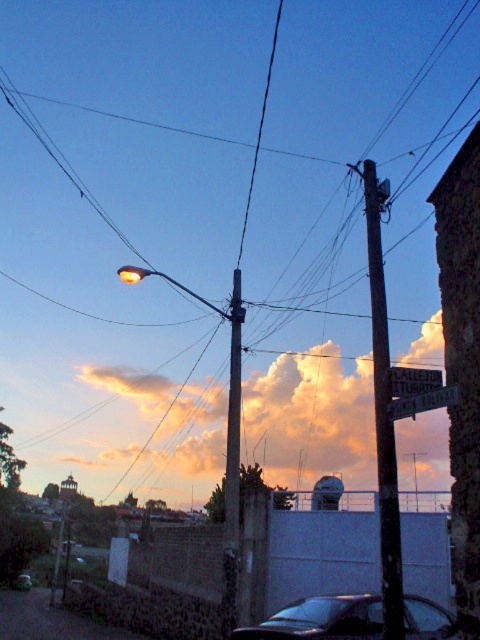
Question: Which point is closer to the camera?

Choices:
 (A) matte metal street light at upper left
 (B) black wire at upper center
 (C) shiny black car at lower center
 (D) metallic silver street sign at upper right

Answer: (D)

Question: Is shiny black car at lower center below metallic silver sign at upper center?

Choices:
 (A) no
 (B) yes

Answer: (B)

Question: Which object is the closest to the matte metal street light at upper left?

Choices:
 (A) shiny black car at lower center
 (B) metallic silver sign at upper center
 (C) wooden telephone pole at center
 (D) cloudy sky at upper center

Answer: (A)

Question: Can you confirm if shiny black car at lower center is positioned above matte metal street light at upper left?

Choices:
 (A) no
 (B) yes

Answer: (A)

Question: Which point appears closest to the camera in this image?

Choices:
 (A) (338, 355)
 (B) (233, 566)

Answer: (B)

Question: Is cloudy sky at upper center thinner than metallic silver street sign at upper right?

Choices:
 (A) yes
 (B) no

Answer: (B)